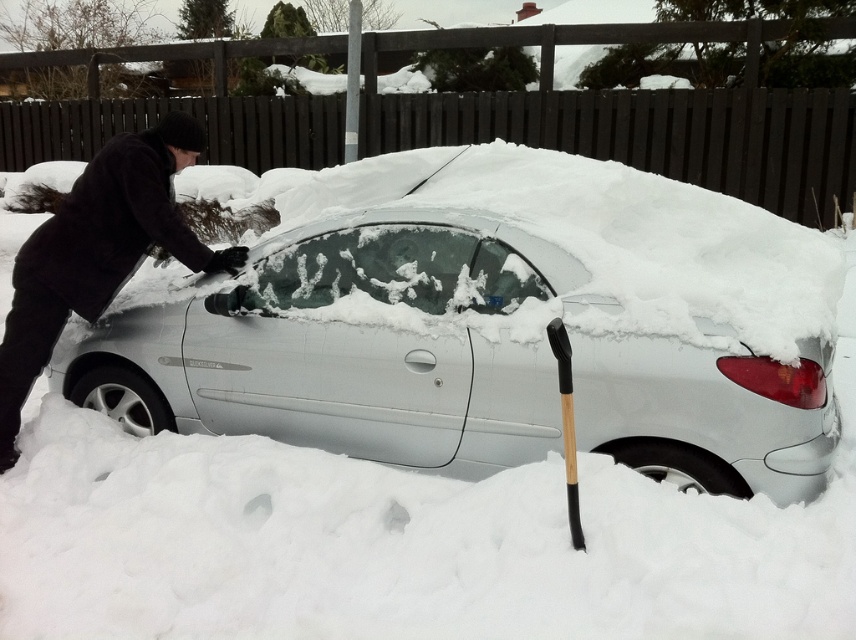
Is black woolen hat at upper left to the right of transparent ice windshield at center from the viewer's perspective?

Incorrect, black woolen hat at upper left is not on the right side of transparent ice windshield at center.

Can you confirm if black woolen hat at upper left is shorter than transparent ice windshield at center?

In fact, black woolen hat at upper left may be taller than transparent ice windshield at center.

Is point (143, 256) closer to camera compared to point (531, 291)?

No.

What are the coordinates of `black woolen hat at upper left` in the screenshot? It's located at (98, 252).

Is black woolen hat at upper left positioned in front of black wood shovel at lower right?

No, black woolen hat at upper left is further to the viewer.

Does black woolen hat at upper left come behind black wood shovel at lower right?

That is True.

Which is behind, point (153, 195) or point (556, 355)?

Positioned behind is point (153, 195).

Where is `black woolen hat at upper left`? black woolen hat at upper left is located at coordinates (98, 252).

Which of these two, white matte car at center or transparent ice windshield at center, stands taller?

Standing taller between the two is white matte car at center.

Is point (90, 369) positioned after point (455, 285)?

Yes, it is behind point (455, 285).

At what (x,y) coordinates should I click in order to perform the action: click on white matte car at center. Please return your answer as a coordinate pair (x, y). Looking at the image, I should click on (498, 326).